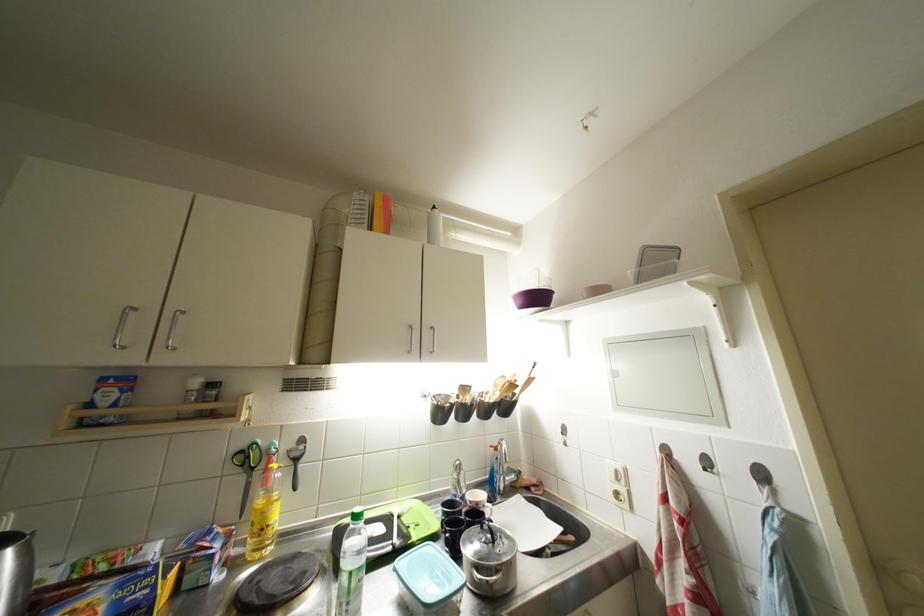
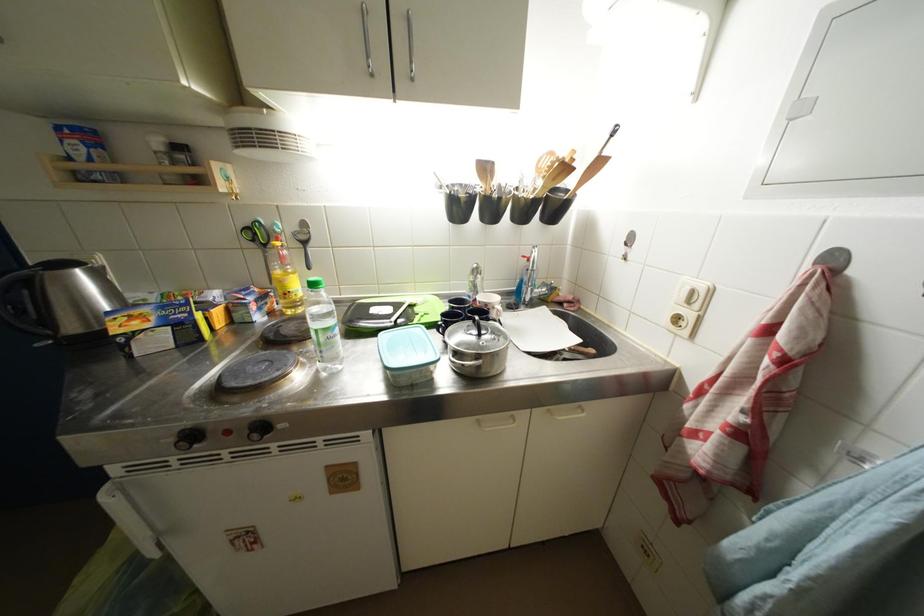
The point at (466, 487) is marked in the first image. Where is the corresponding point in the second image?

(481, 291)